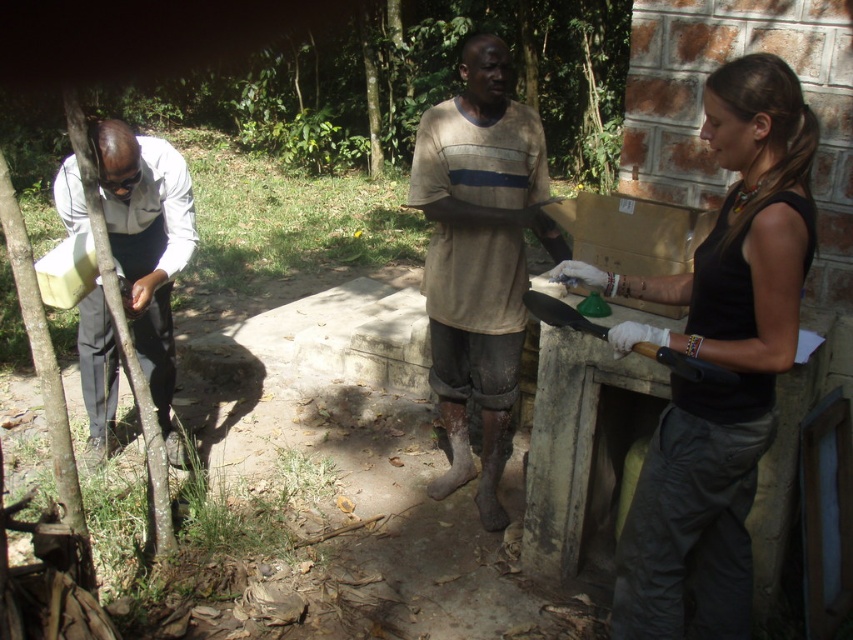
Question: Which object is farther from the camera taking this photo?

Choices:
 (A) black matte tank top at right
 (B) brown cotton shirt at center

Answer: (B)

Question: Is black matte tank top at right bigger than matte white shirt at left?

Choices:
 (A) no
 (B) yes

Answer: (A)

Question: Does black matte tank top at right have a lesser width compared to matte white shirt at left?

Choices:
 (A) yes
 (B) no

Answer: (A)

Question: Estimate the real-world distances between objects in this image. Which object is farther from the brown cotton shirt at center?

Choices:
 (A) black matte tank top at right
 (B) matte white shirt at left

Answer: (B)

Question: Does brown cotton shirt at center appear on the right side of matte white shirt at left?

Choices:
 (A) no
 (B) yes

Answer: (B)

Question: Estimate the real-world distances between objects in this image. Which object is closer to the matte white shirt at left?

Choices:
 (A) brown cotton shirt at center
 (B) black matte tank top at right

Answer: (A)